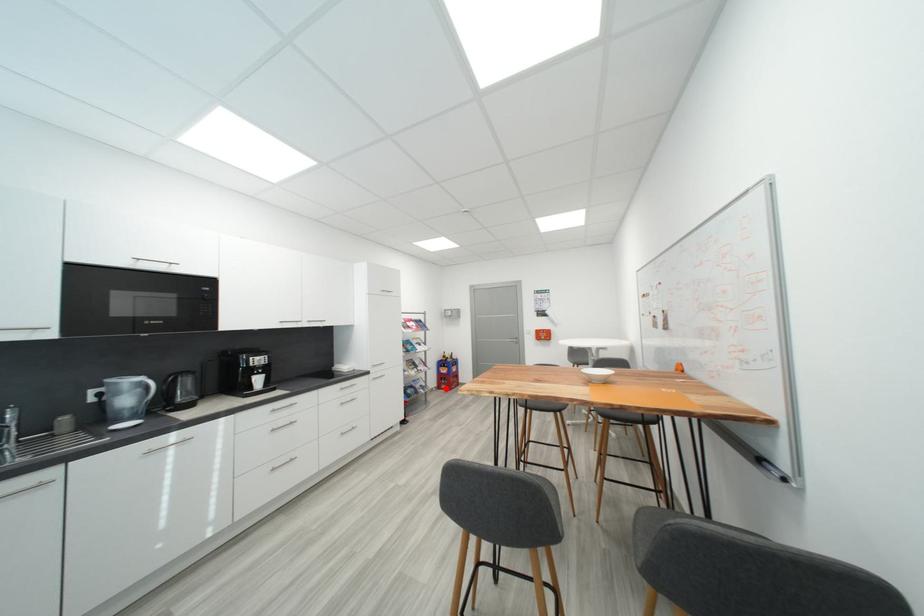
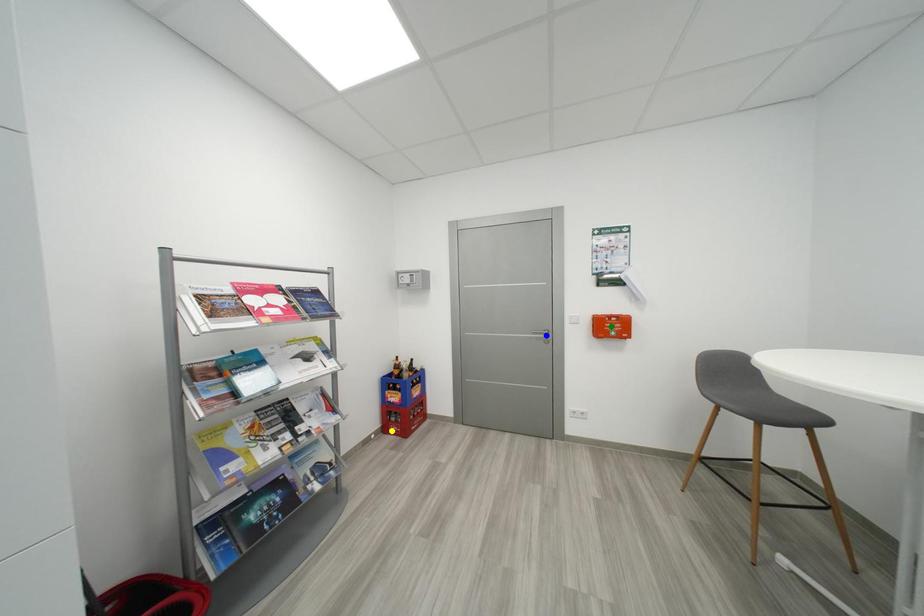
Question: I am providing you with two images of the same scene from different viewpoints. A red point is marked on the first image. You are given multiple points on the second image. Which point in image 2 represents the same 3d spot as the red point in image 1?

Choices:
 (A) green point
 (B) blue point
 (C) yellow point

Answer: (C)